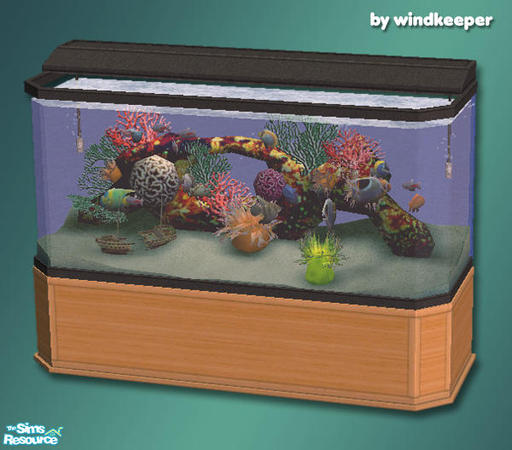
You are a GUI agent. You are given a task and a screenshot of the screen. Output one action in this format:
    pyautogui.click(x=<x>, y=<y>)
    Task: Click on the fish tank
    This screenshot has width=512, height=450.
    Given the screenshot: What is the action you would take?
    pyautogui.click(x=35, y=260)